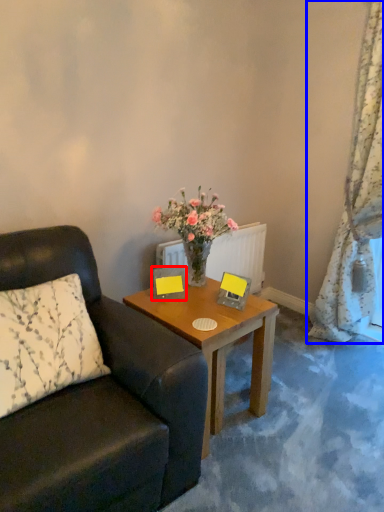
Question: Which object is closer to the camera taking this photo, picture frame (highlighted by a red box) or curtain (highlighted by a blue box)?

Choices:
 (A) picture frame
 (B) curtain

Answer: (B)